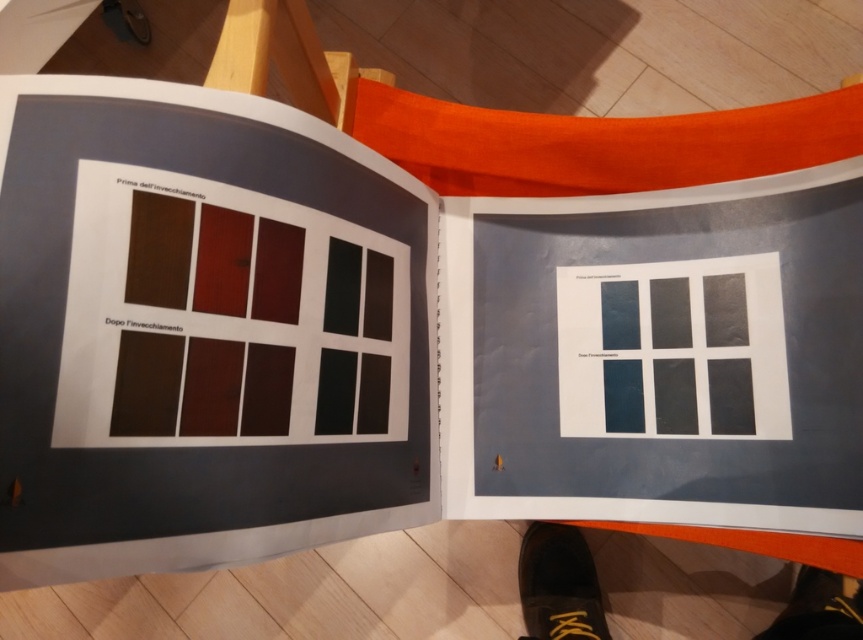
Question: Does black leather shoe at lower right have a greater width compared to black leather shoe at lower center?

Choices:
 (A) yes
 (B) no

Answer: (B)

Question: Does black leather shoe at lower right have a lesser width compared to black leather shoe at lower center?

Choices:
 (A) no
 (B) yes

Answer: (B)

Question: Which point is farther to the camera?

Choices:
 (A) black leather shoe at lower right
 (B) black leather shoe at lower center

Answer: (B)

Question: Can you confirm if black leather shoe at lower right is positioned above black leather shoe at lower center?

Choices:
 (A) yes
 (B) no

Answer: (A)

Question: Among these objects, which one is farthest from the camera?

Choices:
 (A) black leather shoe at lower right
 (B) black leather shoe at lower center

Answer: (B)